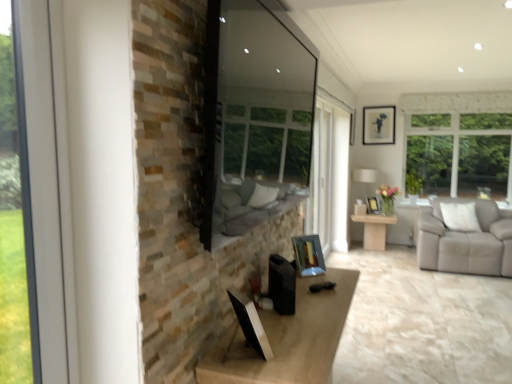
Question: Can you confirm if metallic silver picture frame at center-right, the second picture frame from the top, is shorter than clear glass window at left?

Choices:
 (A) yes
 (B) no

Answer: (A)

Question: Does metallic silver picture frame at center-right, positioned as the 2th picture frame in back-to-front order, have a smaller size compared to clear glass window at left?

Choices:
 (A) yes
 (B) no

Answer: (A)

Question: Can you confirm if metallic silver picture frame at center-right, acting as the second picture frame starting from the right, is positioned to the left of clear glass window at left?

Choices:
 (A) yes
 (B) no

Answer: (B)

Question: Is metallic silver picture frame at center-right, which is the second picture frame from front to back, in contact with clear glass window at left?

Choices:
 (A) yes
 (B) no

Answer: (B)

Question: Is metallic silver picture frame at center-right, which is the 2th picture frame in left-to-right order, thinner than clear glass window at left?

Choices:
 (A) no
 (B) yes

Answer: (A)

Question: Can clear glass window at left be found inside metallic silver picture frame at center-right, positioned as the 2th picture frame in back-to-front order?

Choices:
 (A) no
 (B) yes

Answer: (A)

Question: Is light wood table at center positioned behind metallic silver picture frame at center, arranged as the third picture frame when viewed from the top?

Choices:
 (A) no
 (B) yes

Answer: (B)

Question: Can you confirm if light wood table at center is wider than metallic silver picture frame at center, the 3th picture frame positioned from the right?

Choices:
 (A) yes
 (B) no

Answer: (A)

Question: From the image's perspective, is light wood table at center under metallic silver picture frame at center, which is counted as the first picture frame, starting from the left?

Choices:
 (A) no
 (B) yes

Answer: (B)

Question: Can you confirm if light wood table at center is shorter than metallic silver picture frame at center, the 3th picture frame positioned from the right?

Choices:
 (A) no
 (B) yes

Answer: (A)

Question: From a real-world perspective, is light wood table at center physically below metallic silver picture frame at center, which is counted as the first picture frame, starting from the bottom?

Choices:
 (A) yes
 (B) no

Answer: (A)

Question: Would you say light wood table at center contains metallic silver picture frame at center, which is counted as the first picture frame, starting from the left?

Choices:
 (A) no
 (B) yes

Answer: (A)

Question: Is light wood table at center to the left of transparent glass window screen at center from the viewer's perspective?

Choices:
 (A) yes
 (B) no

Answer: (B)